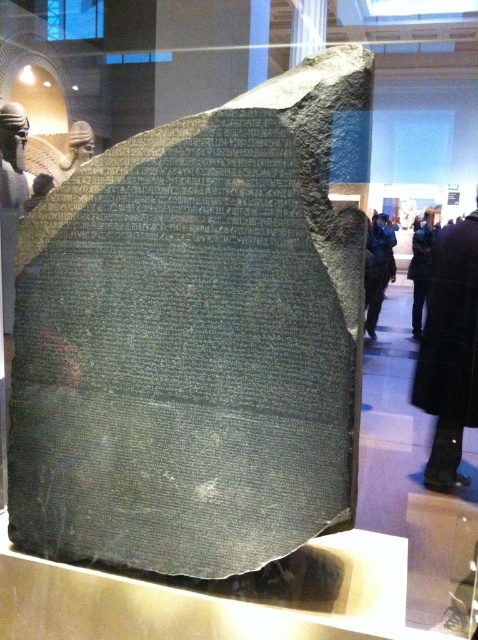
You are a museum security guard who needs to ensure visitors are not too close to the ancient stone artifact. The dark blue coat at center and the black leather coat at lower right are both near the artifact. Which visitor should you ask to step back further since their coat is closer to the artifact?

The dark blue coat at center is closer to the artifact because it is shorter than the black leather coat at lower right, so you should ask the visitor wearing the dark blue coat at center to step back further.

You are a museum security guard who needs to check the width of the coats to ensure they fit in the designated storage area. The storage area has a maximum width limit of 1 meter. You observe the dark blue coat at center and the black leather coat at lower right. Which coat is wider?

The dark blue coat at center is wider than the black leather coat at lower right, so the dark blue coat at center may exceed the storage area width limit of 1 meter if its width surpasses 1 meter. However, without specific measurements, we can only confirm that the dark blue coat at center is wider than the black leather coat at lower right.